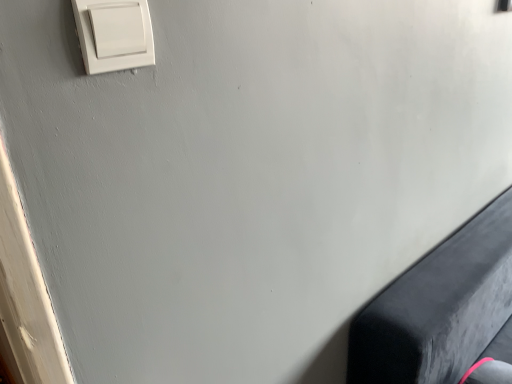
Identify the location of white plastic light switch at upper left. This screenshot has height=384, width=512. (114, 34).

Image resolution: width=512 pixels, height=384 pixels. Describe the element at coordinates (114, 34) in the screenshot. I see `white plastic light switch at upper left` at that location.

Locate an element on the screen. The width and height of the screenshot is (512, 384). white plastic light switch at upper left is located at coordinates (114, 34).